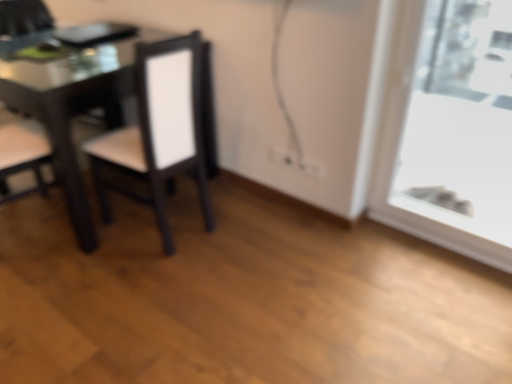
Question: Is matte black chair at center, which ranks as the 2th chair in left-to-right order, bigger or smaller than transparent glass window at right?

Choices:
 (A) big
 (B) small

Answer: (A)

Question: Considering their positions, is matte black chair at center, which ranks as the 2th chair in left-to-right order, located in front of or behind transparent glass window at right?

Choices:
 (A) front
 (B) behind

Answer: (B)

Question: Based on their relative distances, which object is farther from the matte black chair at left, the first chair from the left?

Choices:
 (A) matte black chair at center, the first chair from the right
 (B) transparent glass window at right

Answer: (B)

Question: Estimate the real-world distances between objects in this image. Which object is farther from the transparent glass window at right?

Choices:
 (A) matte black chair at left, the first chair from the left
 (B) matte black chair at center, which ranks as the 2th chair in left-to-right order

Answer: (A)